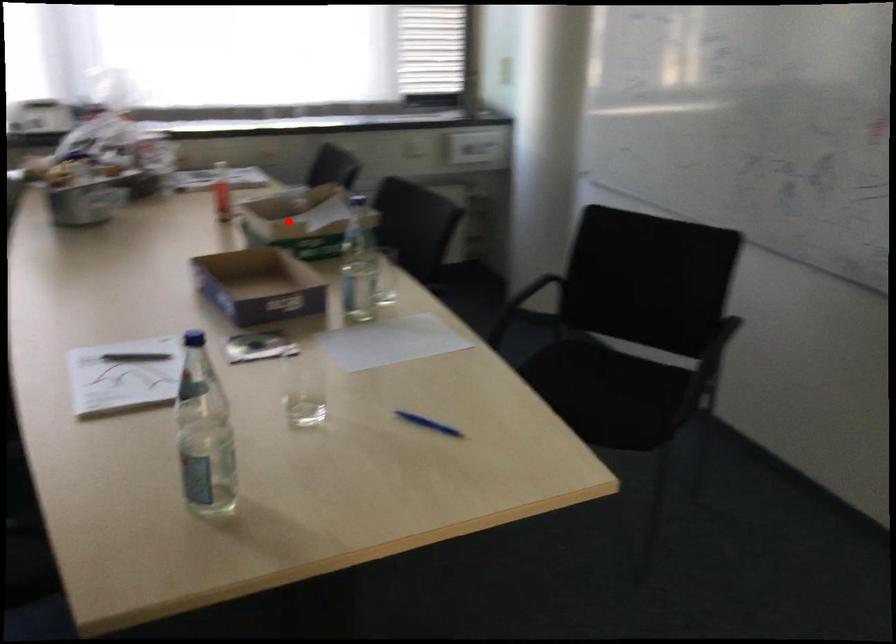
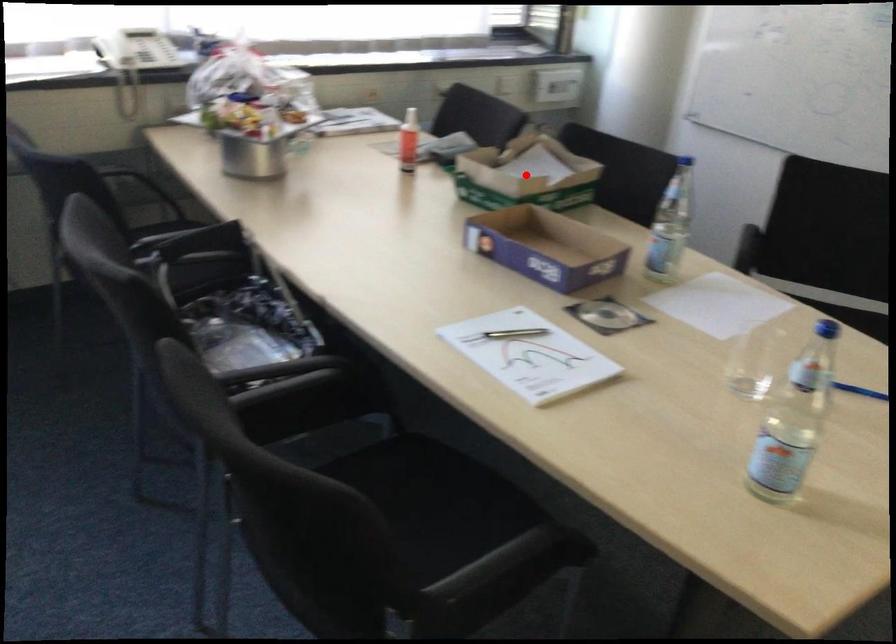
I am providing you with two images of the same scene from different viewpoints. A red point is marked on the first image and another point is marked on the second image. Does the point marked in image1 correspond to the same location as the one in image2?

Yes